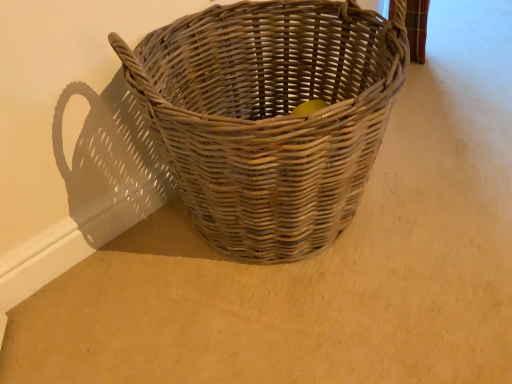
Find the location of `unoccupied region to the right of natural wicker basket at center`. unoccupied region to the right of natural wicker basket at center is located at coordinates (446, 171).